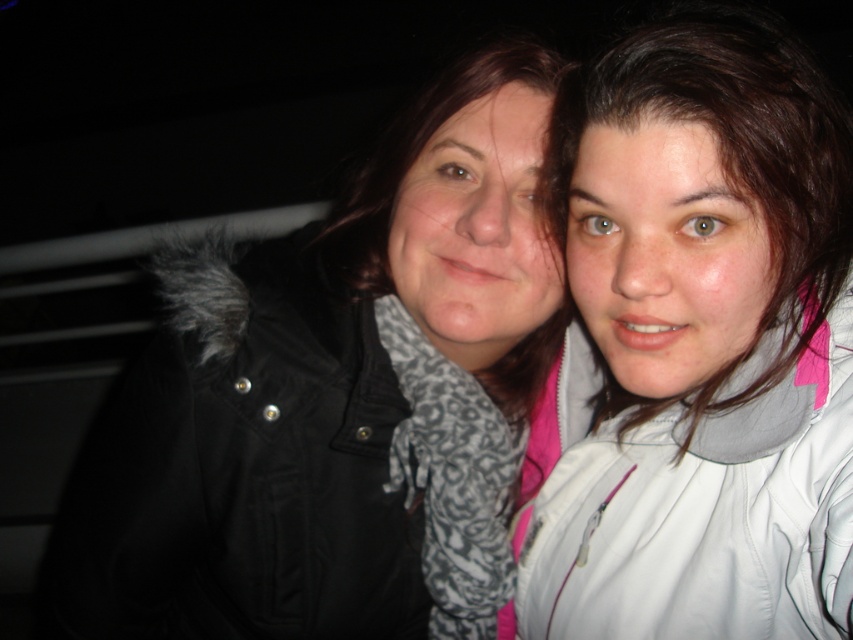
How far apart are black matte jacket at center and white matte jacket at right?

black matte jacket at center and white matte jacket at right are 21.91 centimeters apart.

The image size is (853, 640). Find the location of `black matte jacket at center`. black matte jacket at center is located at coordinates (335, 400).

Locate an element on the screen. black matte jacket at center is located at coordinates (335, 400).

This screenshot has height=640, width=853. In order to click on black matte jacket at center in this screenshot , I will do `click(335, 400)`.